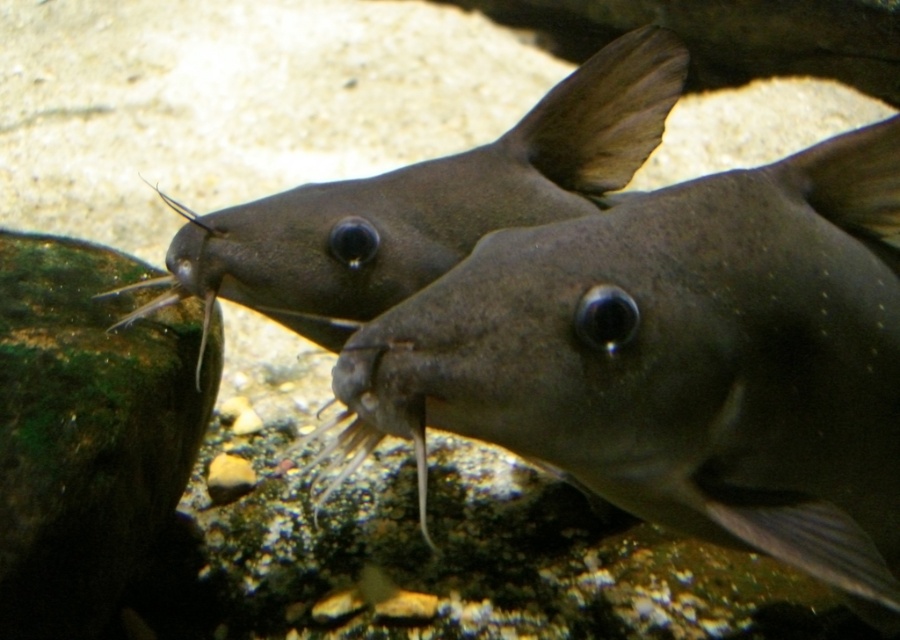
You are an aquarium keeper trying to place a divider between the smooth gray fish at center and the matte gray fish at center. Since the tank is narrow, you need to know which fish is wider to ensure there is enough space. Which fish has a greater width?

The matte gray fish at center has a greater width compared to the smooth gray fish at center, so you should account for its size when placing the divider.

You are an aquatic biologist observing two catfish in an aquarium. You notice a smooth gray fish at center and a matte gray fish at center. Which fish is located below the other?

The smooth gray fish at center is positioned under the matte gray fish at center.

You are an aquatic biologist observing an aquarium. You need to locate the smooth gray fish at center. What are its coordinates?

The smooth gray fish at center is located at coordinates point (680, 358).